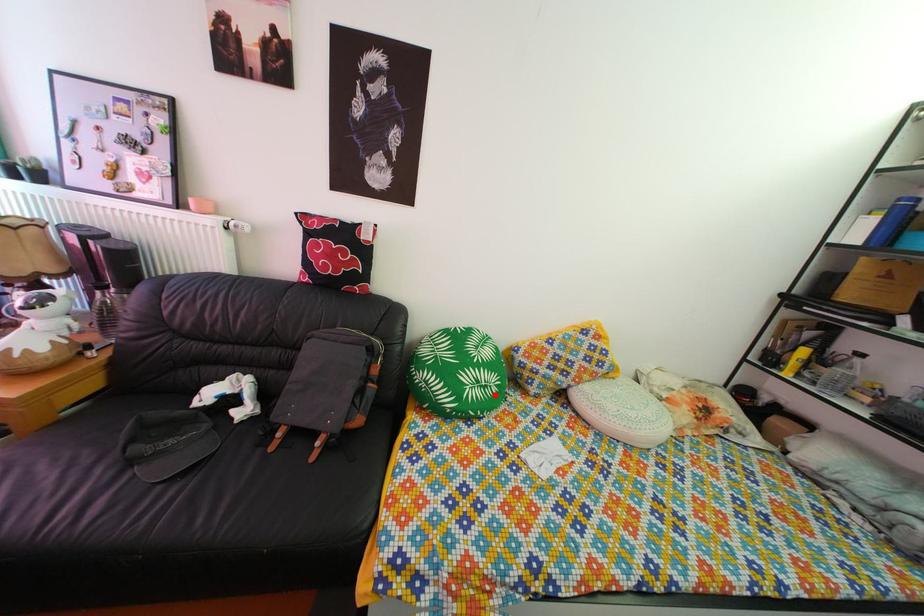
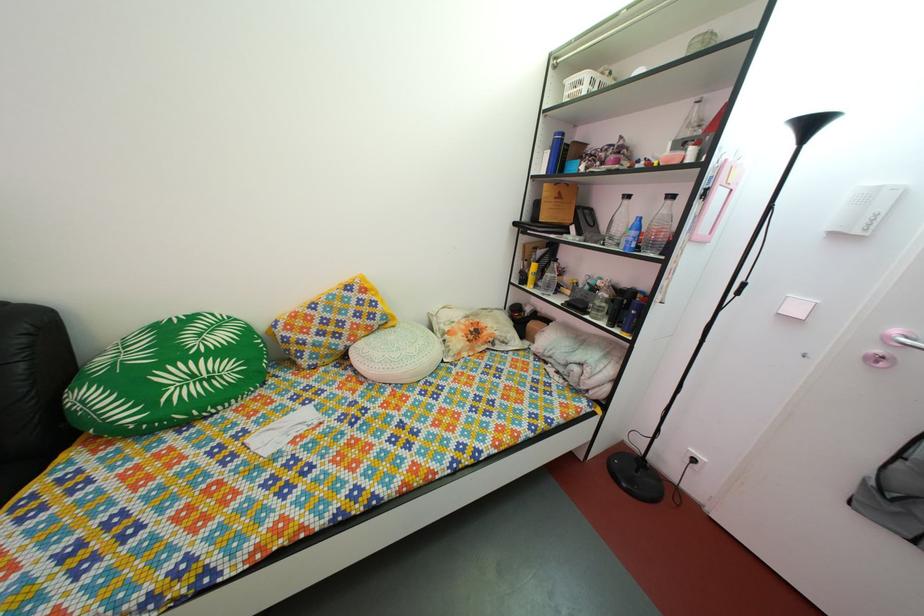
Question: I am providing you with two images of the same scene from different viewpoints. Image1 has a red point marked. In image2, the corresponding 3D location appears at what relative position? Reply with the corresponding letter.

Choices:
 (A) Closer
 (B) Farther

Answer: (A)